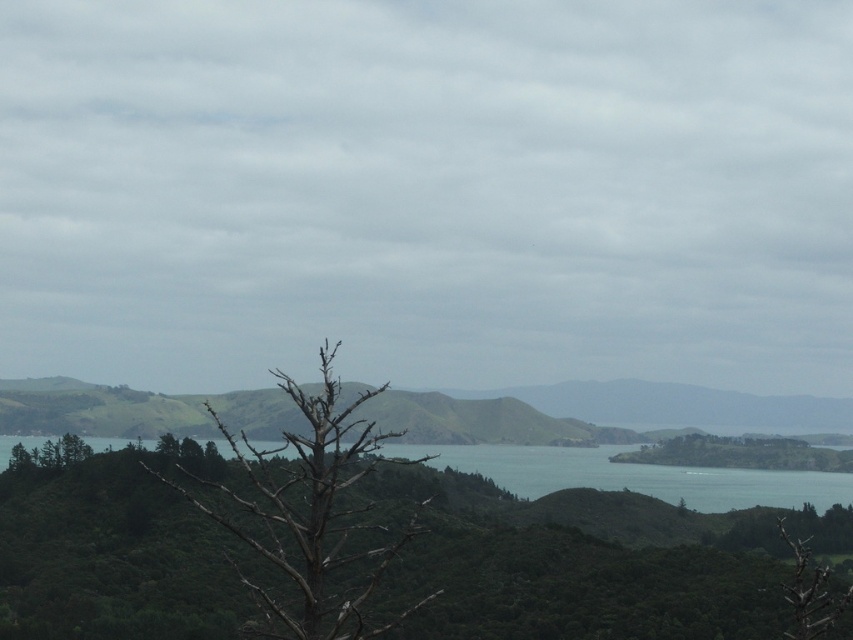
This screenshot has width=853, height=640. What are the coordinates of `bare wood tree at center` in the screenshot? It's located at (312, 509).

Identify the location of bare wood tree at center. (312, 509).

This screenshot has width=853, height=640. I want to click on bare wood tree at center, so click(312, 509).